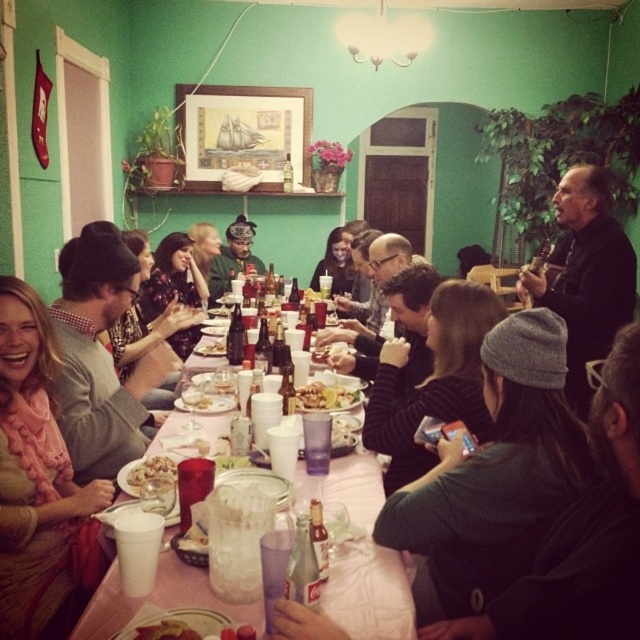
Question: Can you confirm if black sweater at center is positioned to the left of white paper plate at table center?

Choices:
 (A) yes
 (B) no

Answer: (B)

Question: Where is pink ruffled scarf at upper left located in relation to yellowish matte food at center in the image?

Choices:
 (A) below
 (B) above

Answer: (A)

Question: Among these points, which one is nearest to the camera?

Choices:
 (A) (468, 412)
 (B) (86, 259)

Answer: (A)

Question: Which of the following is the farthest from the observer?

Choices:
 (A) gray knit cap at center
 (B) brown crispy bread at lower left
 (C) golden brown crumbly pastry at table center
 (D) pink ruffled scarf at upper left

Answer: (C)

Question: Does pink ruffled scarf at upper left have a lesser width compared to golden brown crumbly pastry at table center?

Choices:
 (A) yes
 (B) no

Answer: (B)

Question: Which object appears closest to the camera in this image?

Choices:
 (A) golden brown crumbly pastry at table center
 (B) white paper plate at table center
 (C) matte gray sweater at center

Answer: (A)